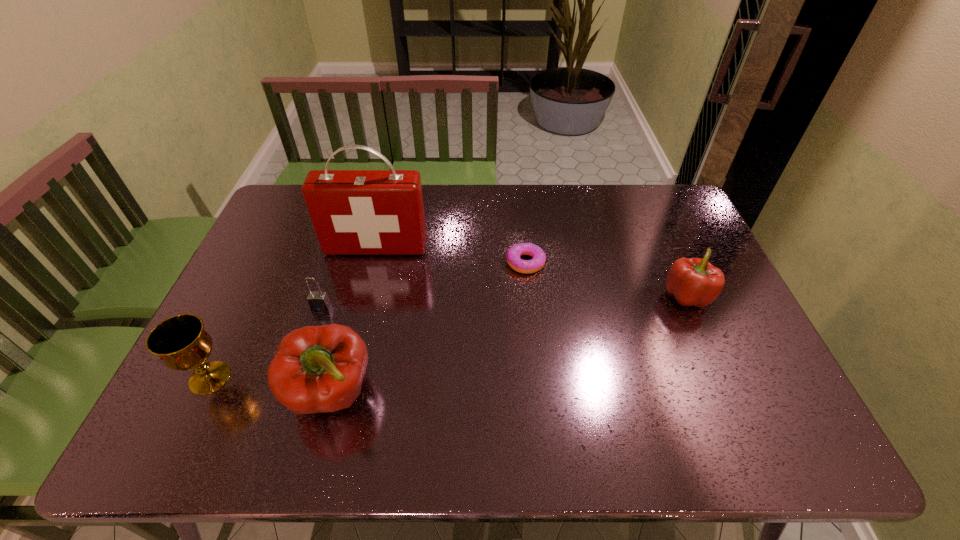
The height and width of the screenshot is (540, 960). I want to click on free spot that satisfies the following two spatial constraints: 1. on the front face of the first-aid kit; 2. on the left side of the fifth object from left to right, so click(x=372, y=262).

This screenshot has height=540, width=960. I want to click on blank area in the image that satisfies the following two spatial constraints: 1. on the front side of the leftmost object; 2. on the left side of the taller bell pepper, so click(202, 394).